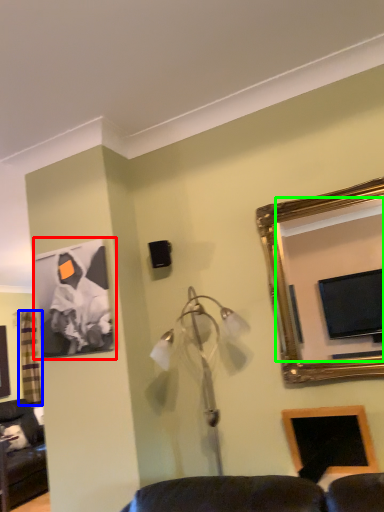
Question: Based on their relative distances, which object is farther from picture frame (highlighted by a red box)? Choose from curtain (highlighted by a blue box) and mirror (highlighted by a green box).

Choices:
 (A) curtain
 (B) mirror

Answer: (A)